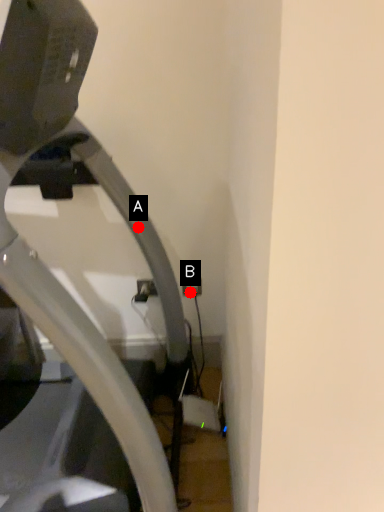
Question: Two points are circled on the image, labeled by A and B beside each circle. Which point is farther from the camera taking this photo?

Choices:
 (A) A is further
 (B) B is further

Answer: (B)